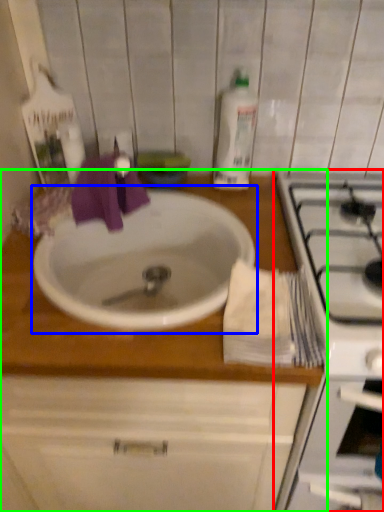
Question: Which object is the farthest from appliance (highlighted by a red box)? Choose among these: sink (highlighted by a blue box) or countertop (highlighted by a green box).

Choices:
 (A) sink
 (B) countertop

Answer: (A)